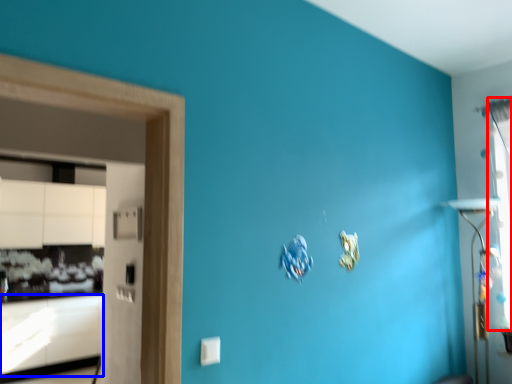
Question: Which object is further to the camera taking this photo, window (highlighted by a red box) or cabinetry (highlighted by a blue box)?

Choices:
 (A) window
 (B) cabinetry

Answer: (B)